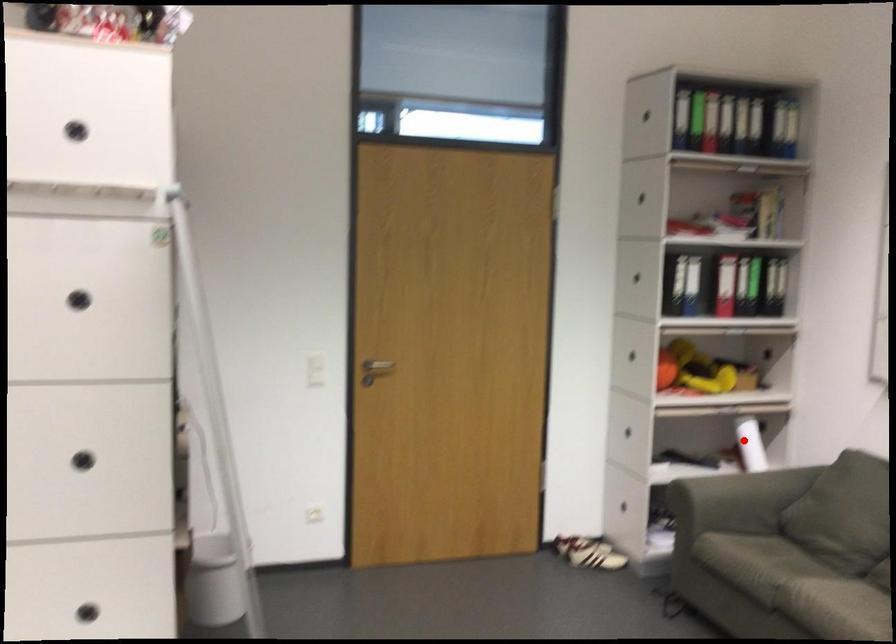
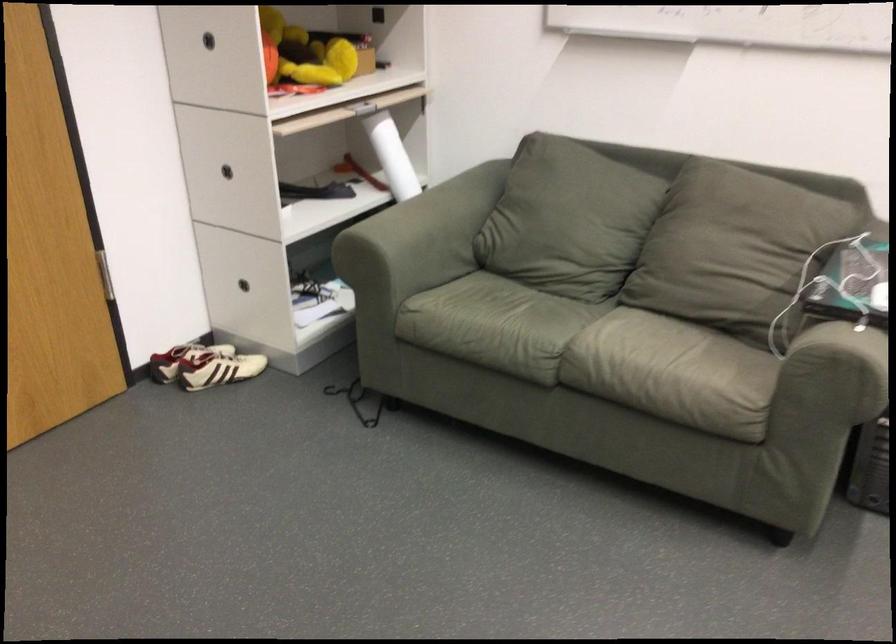
Question: I am providing you with two images of the same scene from different viewpoints. In image1, a red point is highlighted. Considering the same 3D point in image2, which of the following is correct?

Choices:
 (A) It is closer
 (B) It is farther

Answer: (A)